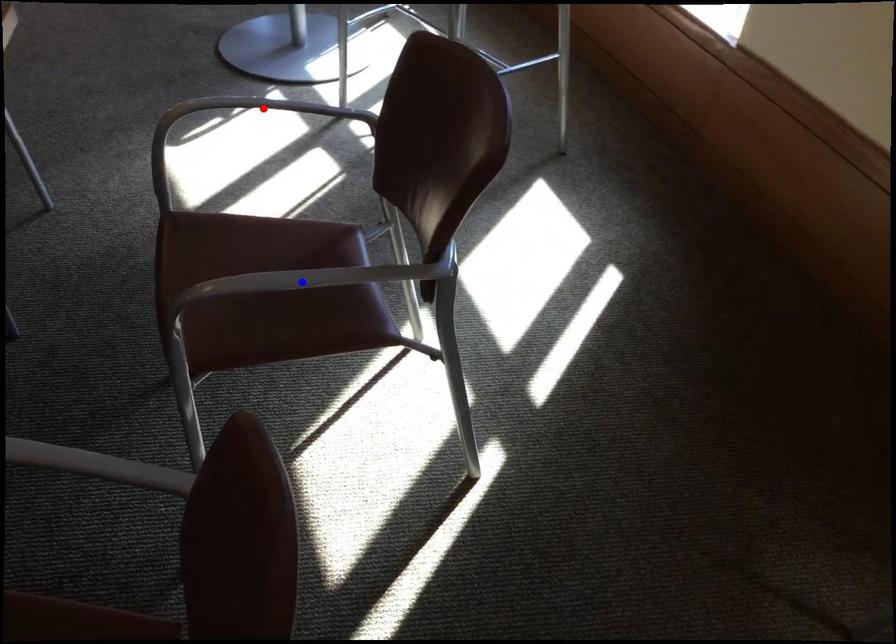
Question: In the image, two points are highlighted. Which point is nearer to the camera? Reply with the corresponding letter.

Choices:
 (A) blue point
 (B) red point

Answer: (A)